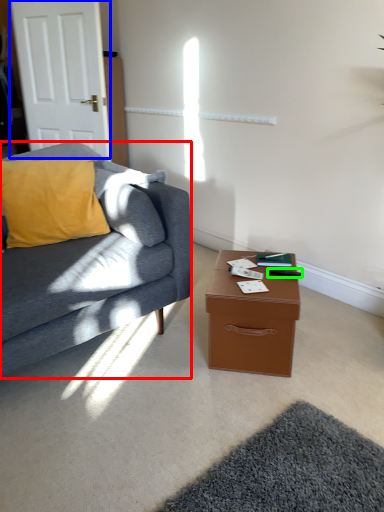
Question: Which object is the farthest from studio couch (highlighted by a red box)? Choose among these: door (highlighted by a blue box) or remote control (highlighted by a green box).

Choices:
 (A) door
 (B) remote control

Answer: (A)